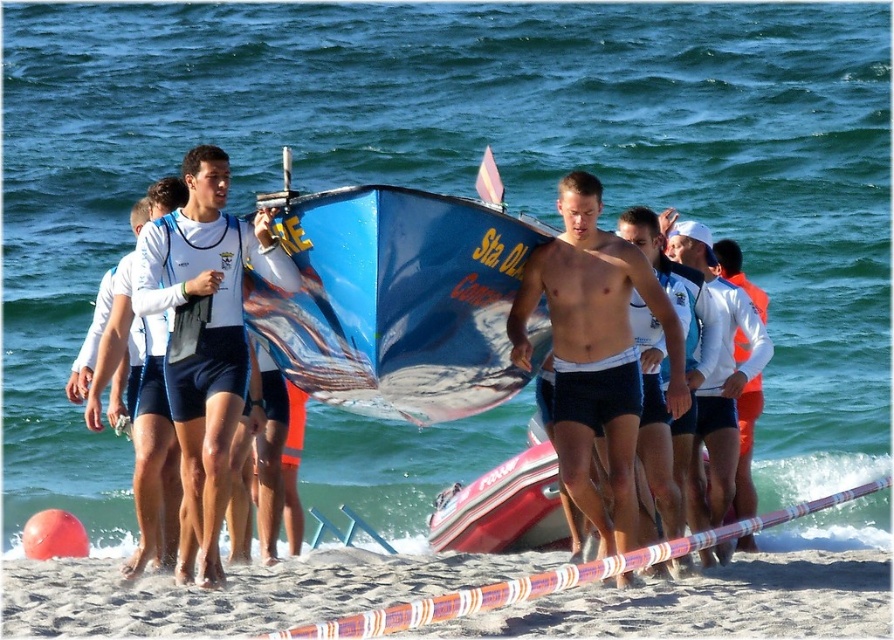
Is matte white life vest at center further to camera compared to shiny blue shorts at center?

No, matte white life vest at center is closer to the viewer.

Is point (233, 317) positioned in front of point (670, 452)?

Yes, point (233, 317) is closer to viewer.

Find the location of `matte white life vest at center`. matte white life vest at center is located at coordinates (207, 330).

Is point (734, 444) farther from viewer compared to point (105, 326)?

Yes, point (734, 444) is behind point (105, 326).

Does point (704, 445) lie behind point (157, 496)?

Yes, point (704, 445) is farther from viewer.

Identify the location of white matte jacket at upper center. pos(717,380).

Is white sand at lower center bigger than white matte shorts at left?

Incorrect, white sand at lower center is not larger than white matte shorts at left.

Does point (238, 625) lie behind point (173, 198)?

No, (238, 625) is closer to viewer.

The height and width of the screenshot is (640, 894). I want to click on white sand at lower center, so click(229, 593).

Where is `white sand at lower center`? The image size is (894, 640). white sand at lower center is located at coordinates (229, 593).